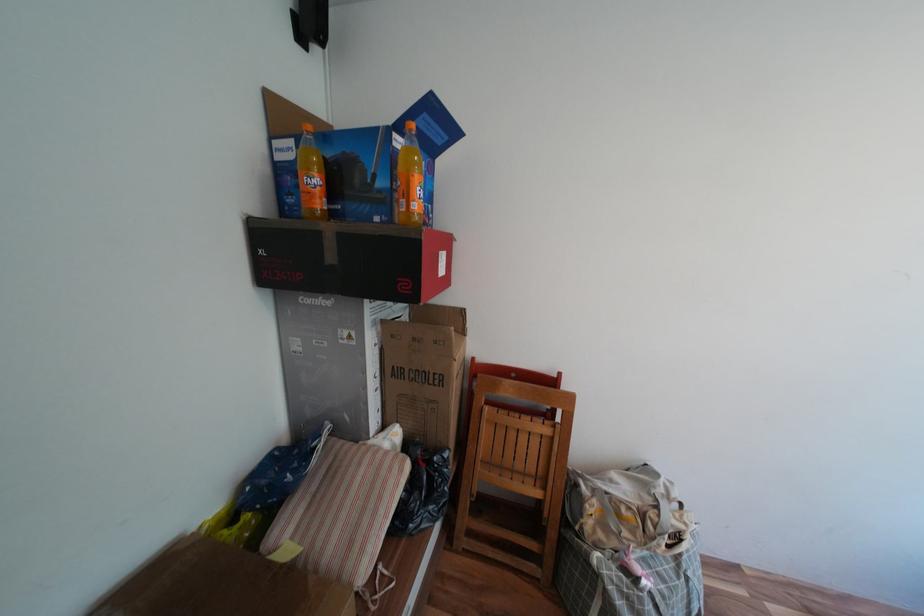
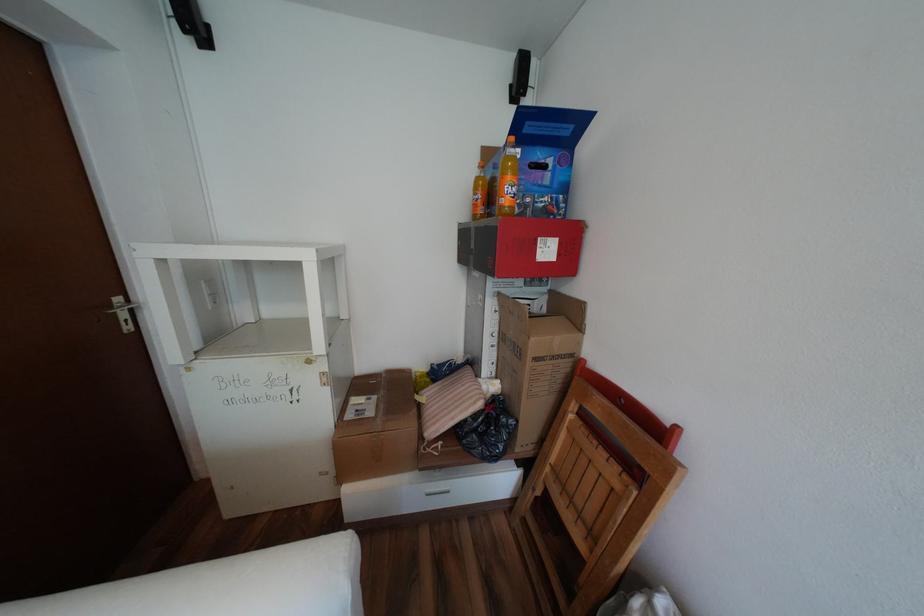
Where in the second image is the point corresponding to point 423,200 from the first image?

(512, 197)